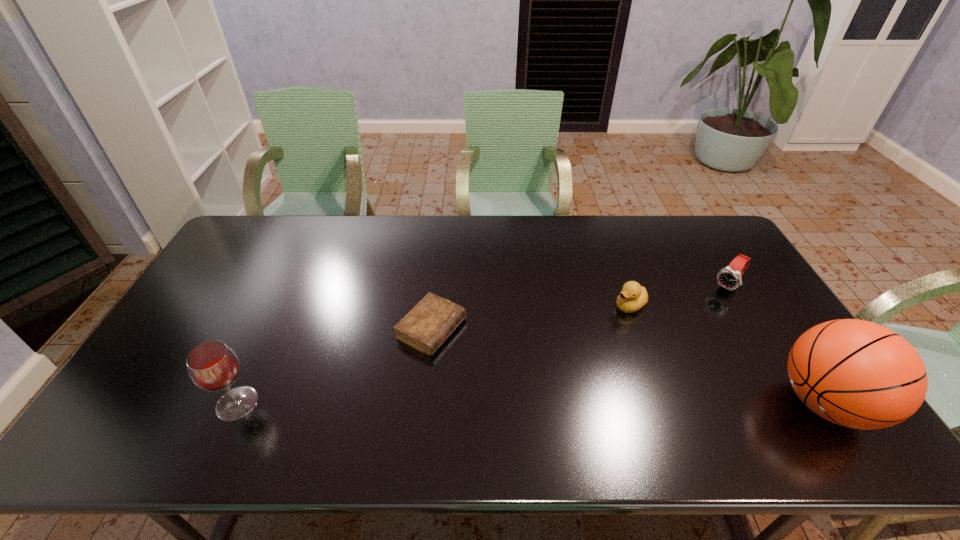
Find the location of a particular element. The width and height of the screenshot is (960, 540). vacant spot on the desktop that is between the leftmost object and the basketball and is positioned on the face of the watch is located at coordinates (617, 403).

Where is `free space on the desktop that is between the fourth shortest object and the tallest object and is positioned facing forward on the duckling`? free space on the desktop that is between the fourth shortest object and the tallest object and is positioned facing forward on the duckling is located at coordinates (463, 403).

Image resolution: width=960 pixels, height=540 pixels. I want to click on free spot on the desktop that is between the wineglass and the tallest object and is positioned on the spine side of the shortest object, so click(583, 403).